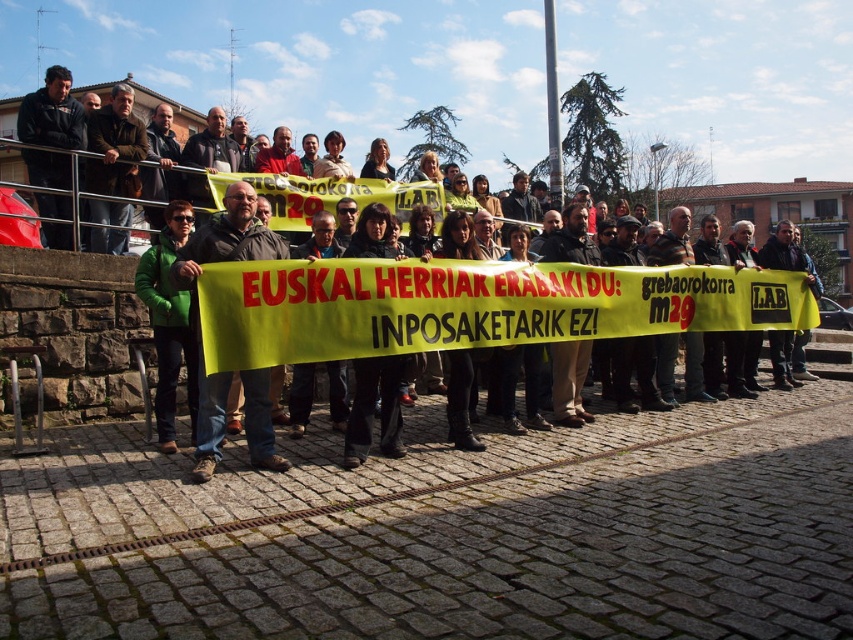
What is located at the coordinates point (74,324)?

The green fabric banner at center is located at point (74,324).

Please provide the 2D coordinates of the green fabric banner at center in the image.

A: The green fabric banner at center is located at coordinates [74,324].

You are a photographer aiming to capture the entire group holding the banner. You notice two points marked on your camera screen at coordinates point (141, 317) and point (207, 257). Which point is closer to the front of the group?

Point (207, 257) is closer to the front of the group because it is in front of point (141, 317).